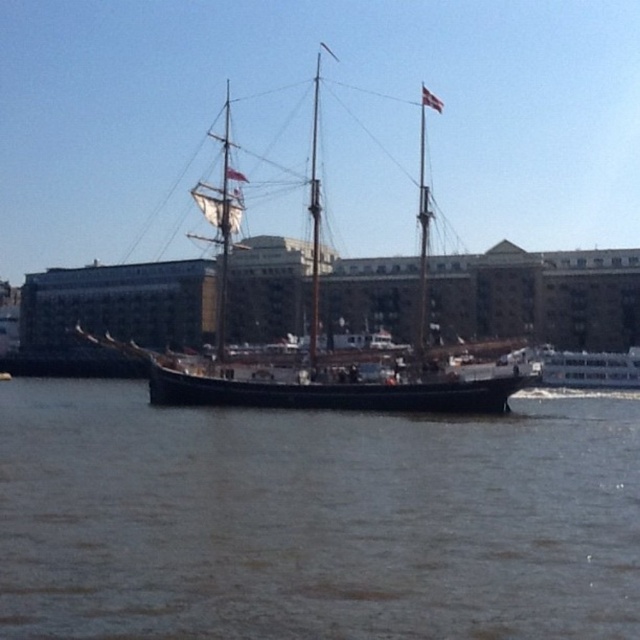
How much distance is there between brown water at center and wooden ship at center?

A distance of 15.67 meters exists between brown water at center and wooden ship at center.

Can you confirm if brown water at center is taller than wooden ship at center?

In fact, brown water at center may be shorter than wooden ship at center.

In order to click on brown water at center in this screenshot , I will do `click(316, 518)`.

Based on the photo, which of these two, brown water at center or smooth wood mast at center, stands taller?

With more height is smooth wood mast at center.

At what (x,y) coordinates should I click in order to perform the action: click on brown water at center. Please return your answer as a coordinate pair (x, y). This screenshot has width=640, height=640. Looking at the image, I should click on (316, 518).

Between point (236, 545) and point (312, 129), which one is positioned in front?

Point (236, 545) is in front.

Image resolution: width=640 pixels, height=640 pixels. In order to click on brown water at center in this screenshot , I will do `click(316, 518)`.

Does smooth wood mast at center appear on the left side of polished wood mast at upper center?

Correct, you'll find smooth wood mast at center to the left of polished wood mast at upper center.

Between smooth wood mast at center and polished wood mast at upper center, which one is positioned higher?

smooth wood mast at center is above.

Where is `smooth wood mast at center`? smooth wood mast at center is located at coordinates (314, 224).